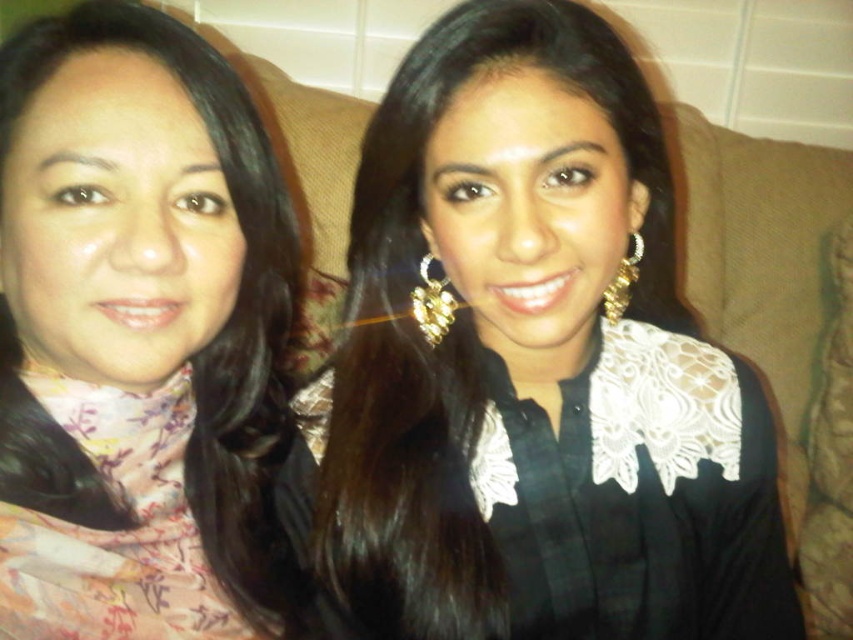
You are a fashion designer observing the image. You need to decide which item has a greater horizontal span between the black lace blouse at center and the gold textured earring at upper right. Which one is wider?

The black lace blouse at center has a larger width than the gold textured earring at upper right, so the black lace blouse at center is wider.

You are standing in front of the image and want to know the distance of the point marked as point [718,470] from you. Can you determine the distance?

The point [718,470] is 25.92 inches away from the viewer.

You are a photographer setting up a shoot and need to ensure that the black lace blouse at center and the gold textured earring at upper right are both visible in the frame. Given their sizes, which object should you focus on first to ensure proper framing?

The black lace blouse at center is bigger than the gold textured earring at upper right, so you should focus on framing the black lace blouse at center first to ensure it fits well in the shot before adjusting for the smaller earring.